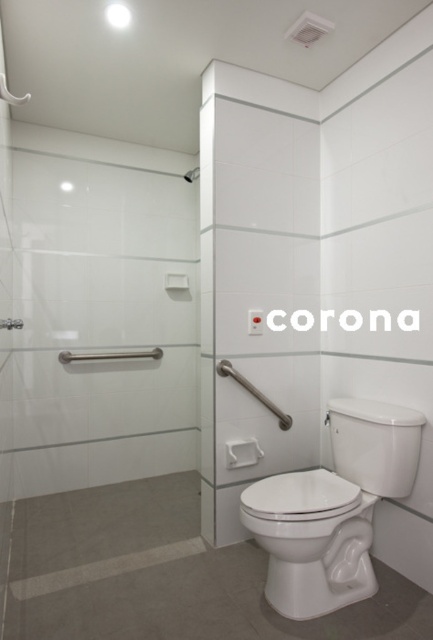
Question: Is white glossy screen door at center above white glossy toilet at lower right?

Choices:
 (A) yes
 (B) no

Answer: (A)

Question: Which object is farther from the camera taking this photo?

Choices:
 (A) satin nickel grab bar at lower center
 (B) white glossy toilet at lower right
 (C) white glossy screen door at center

Answer: (C)

Question: In this image, where is white glossy screen door at center located relative to satin nickel grab bar at lower center?

Choices:
 (A) above
 (B) below

Answer: (A)

Question: Among these points, which one is farthest from the camera?

Choices:
 (A) [x=271, y=340]
 (B) [x=296, y=518]

Answer: (A)

Question: Which object appears closest to the camera in this image?

Choices:
 (A) white glossy screen door at center
 (B) satin nickel grab bar at lower center
 (C) white glossy toilet at lower right

Answer: (C)

Question: Can you confirm if white glossy toilet at lower right is positioned above satin nickel grab bar at lower center?

Choices:
 (A) yes
 (B) no

Answer: (B)